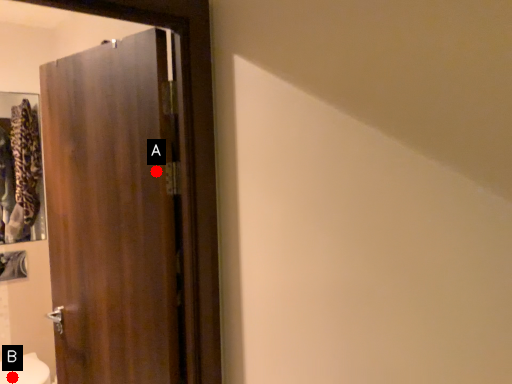
Question: Two points are circled on the image, labeled by A and B beside each circle. Which point is farther from the camera taking this photo?

Choices:
 (A) A is further
 (B) B is further

Answer: (B)